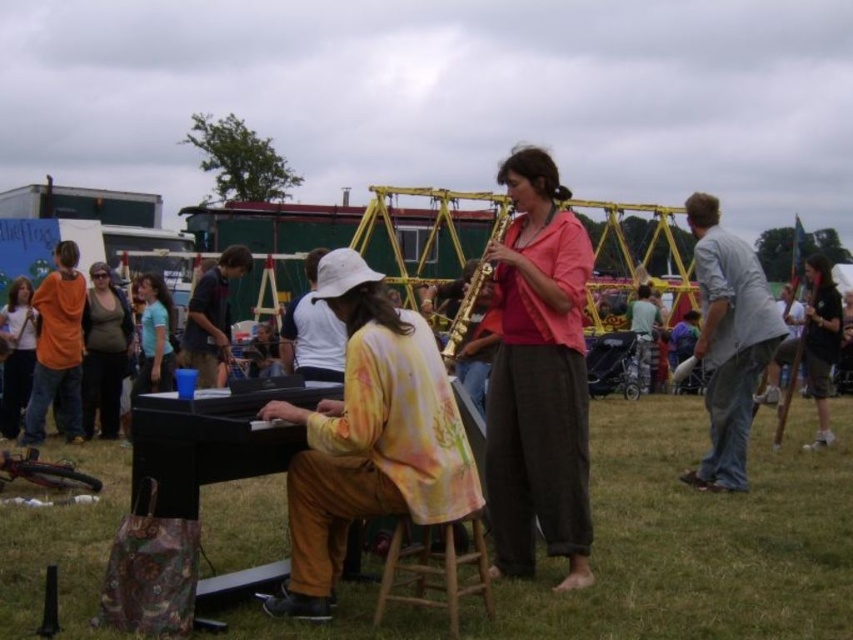
From the picture: You are a photographer at this event and want to capture a photo of both the yellow floral blouse at center and the gold metallic saxophone at center. Which object should you focus on first if you want to ensure both are in frame without moving the camera?

The yellow floral blouse at center is shorter than the gold metallic saxophone at center, so you should focus on the gold metallic saxophone at center first to ensure both are in frame.